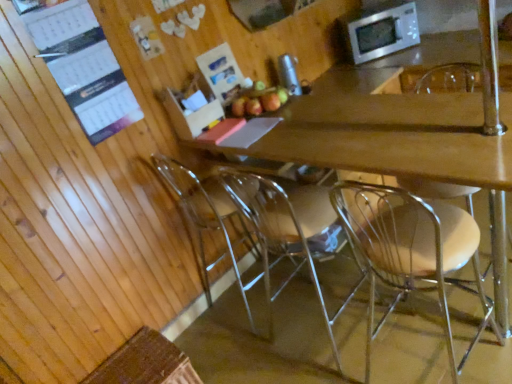
Where is `free spot below clear plastic chair at lower center, the 4th chair when ordered from right to left (from a real-world perspective)`? The height and width of the screenshot is (384, 512). free spot below clear plastic chair at lower center, the 4th chair when ordered from right to left (from a real-world perspective) is located at coordinates (254, 302).